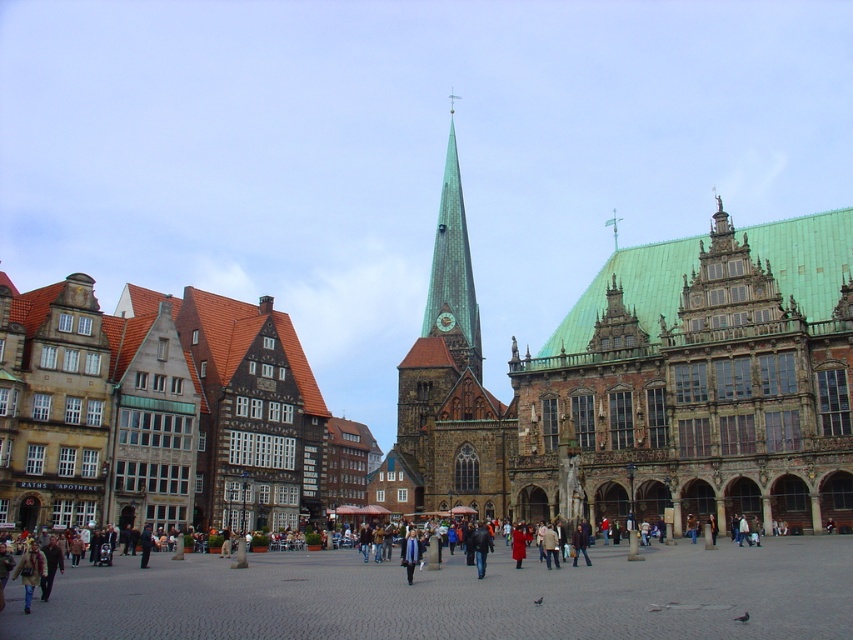
Between brown cobblestone square at center and blue fabric scarf at center, which one is positioned higher?

brown cobblestone square at center

Is brown cobblestone square at center positioned behind blue fabric scarf at center?

No, brown cobblestone square at center is closer to the viewer.

Between point (509, 612) and point (402, 547), which one is positioned behind?

Point (402, 547)

Image resolution: width=853 pixels, height=640 pixels. Identify the location of brown cobblestone square at center. (457, 595).

Describe the element at coordinates (457, 595) in the screenshot. I see `brown cobblestone square at center` at that location.

Which is in front, point (202, 568) or point (448, 396)?

Point (202, 568)

This screenshot has height=640, width=853. What are the coordinates of `brown cobblestone square at center` in the screenshot? It's located at (457, 595).

Is point (471, 500) positioned before point (405, 554)?

No, (471, 500) is behind (405, 554).

Between green stone church at center and blue fabric scarf at center, which one has less height?

With less height is blue fabric scarf at center.

Where is `green stone church at center`? green stone church at center is located at coordinates (643, 384).

You are a GUI agent. You are given a task and a screenshot of the screen. Output one action in this format:
    pyautogui.click(x=<x>, y=<y>)
    Task: Click on the green stone church at center
    The width and height of the screenshot is (853, 640).
    Given the screenshot: What is the action you would take?
    pyautogui.click(x=643, y=384)